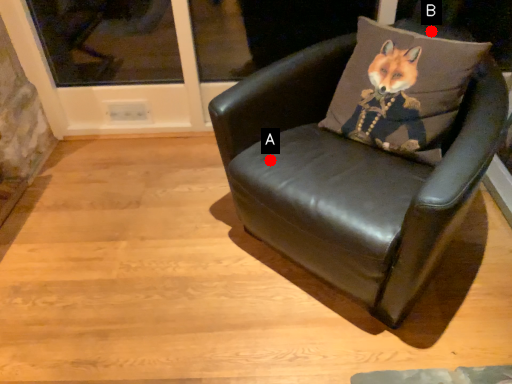
Question: Two points are circled on the image, labeled by A and B beside each circle. Among these points, which one is nearest to the camera?

Choices:
 (A) A is closer
 (B) B is closer

Answer: (A)